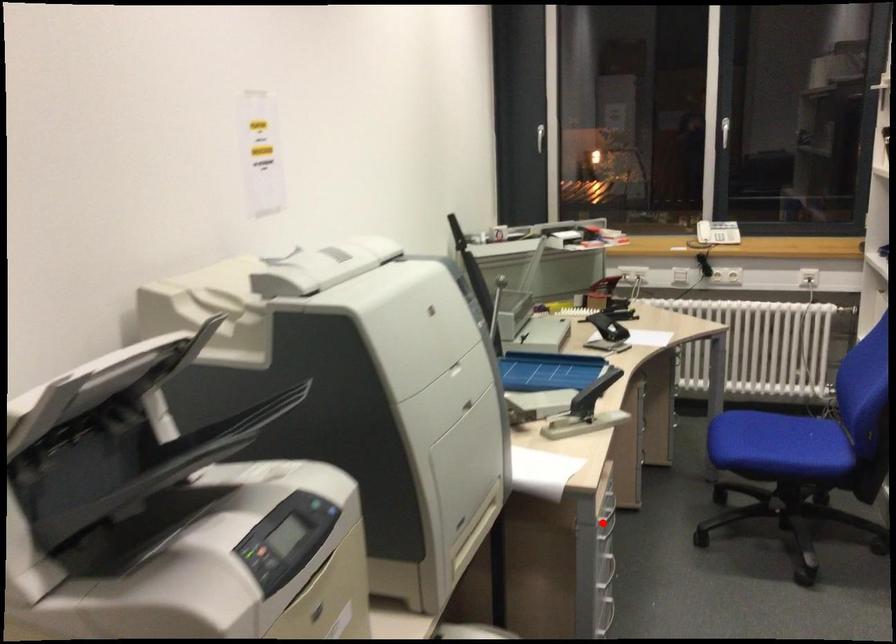
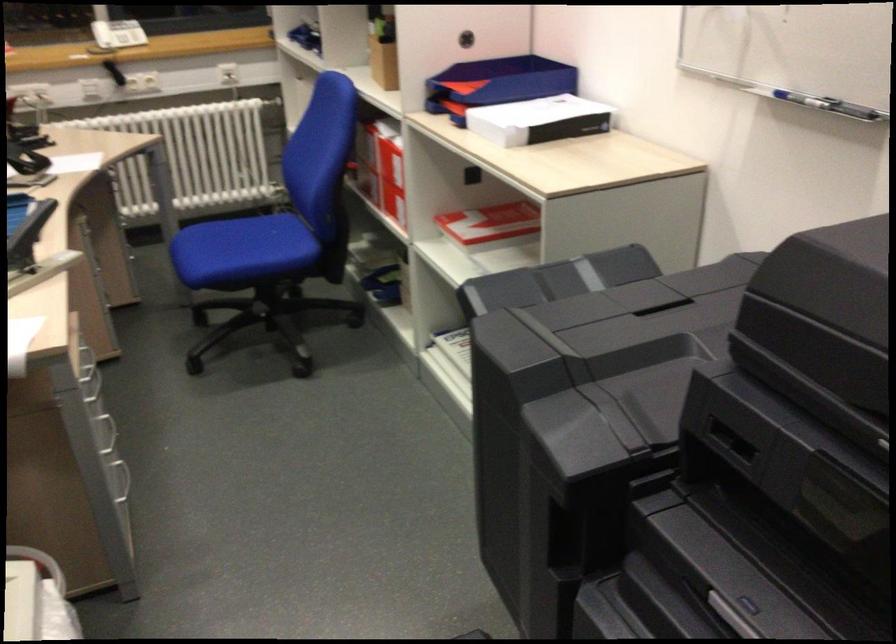
Find the pixel in the second image that matches the highlighted location in the first image.

(92, 386)